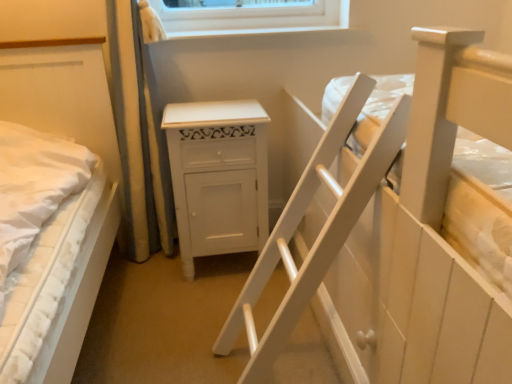
Question: Which is correct: white wooden bed at upper right, the 1th bed viewed from the right, is inside white textured mattress at left, the 2th bed in the right-to-left sequence, or outside of it?

Choices:
 (A) inside
 (B) outside

Answer: (B)

Question: Is white wooden bed at upper right, the 2th bed viewed from the left, wider or thinner than white textured mattress at left, arranged as the 1th bed when viewed from the left?

Choices:
 (A) wide
 (B) thin

Answer: (A)

Question: Which object is positioned farthest from the white textured mattress at left, arranged as the 1th bed when viewed from the left?

Choices:
 (A) white wooden bed at upper right, the 2th bed viewed from the left
 (B) white painted wood cabinet at center

Answer: (A)

Question: Which object is the farthest from the white painted wood cabinet at center?

Choices:
 (A) white wooden bed at upper right, the 1th bed viewed from the right
 (B) white textured mattress at left, arranged as the 1th bed when viewed from the left

Answer: (A)